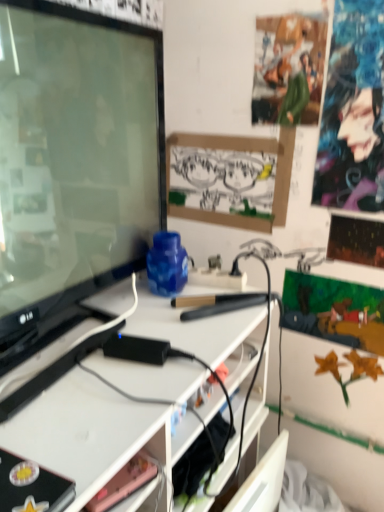
Question: Is purple glossy poster at upper right closer to the viewer compared to matte black book at lower left?

Choices:
 (A) yes
 (B) no

Answer: (B)

Question: From a real-world perspective, is purple glossy poster at upper right under matte black book at lower left?

Choices:
 (A) yes
 (B) no

Answer: (B)

Question: Does purple glossy poster at upper right appear on the left side of matte black book at lower left?

Choices:
 (A) no
 (B) yes

Answer: (A)

Question: Does purple glossy poster at upper right have a larger size compared to matte black book at lower left?

Choices:
 (A) yes
 (B) no

Answer: (B)

Question: Is purple glossy poster at upper right facing away from matte black book at lower left?

Choices:
 (A) yes
 (B) no

Answer: (B)

Question: Is the depth of purple glossy poster at upper right greater than that of matte black book at lower left?

Choices:
 (A) yes
 (B) no

Answer: (A)

Question: From the image's perspective, would you say matte black tv at left is shown under pink matte phone at lower center?

Choices:
 (A) no
 (B) yes

Answer: (A)

Question: Is matte black tv at left at the left side of pink matte phone at lower center?

Choices:
 (A) yes
 (B) no

Answer: (A)

Question: Considering the relative sizes of matte black tv at left and pink matte phone at lower center in the image provided, is matte black tv at left thinner than pink matte phone at lower center?

Choices:
 (A) yes
 (B) no

Answer: (B)

Question: Is matte black tv at left outside of pink matte phone at lower center?

Choices:
 (A) yes
 (B) no

Answer: (A)

Question: Considering the relative sizes of matte black tv at left and pink matte phone at lower center in the image provided, is matte black tv at left bigger than pink matte phone at lower center?

Choices:
 (A) yes
 (B) no

Answer: (A)

Question: Can you confirm if matte black tv at left is wider than pink matte phone at lower center?

Choices:
 (A) no
 (B) yes

Answer: (B)

Question: From the image's perspective, is pink matte phone at lower center under green fabric poster at upper center?

Choices:
 (A) no
 (B) yes

Answer: (B)